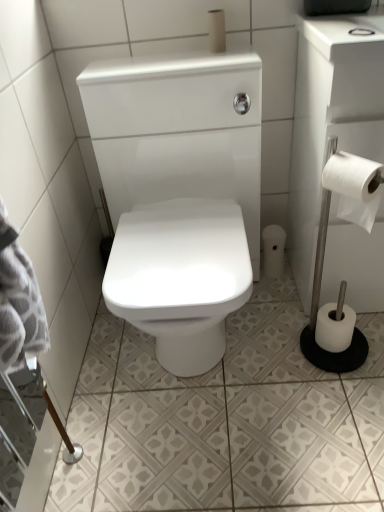
Question: Considering the positions of white paper roll at lower right, the 3th toilet paper in the right-to-left sequence, and white glossy ceramic tile at center in the image, is white paper roll at lower right, the 3th toilet paper in the right-to-left sequence, wider or thinner than white glossy ceramic tile at center?

Choices:
 (A) thin
 (B) wide

Answer: (A)

Question: Would you say white paper roll at lower right, marked as the 2th toilet paper in a left-to-right arrangement, is to the left or to the right of white glossy ceramic tile at center in the picture?

Choices:
 (A) right
 (B) left

Answer: (A)

Question: Considering the real-world distances, which object is closest to the white glossy ceramic tile at center?

Choices:
 (A) white glossy toilet at center
 (B) white paper roll at lower right, marked as the 2th toilet paper in a left-to-right arrangement
 (C) white matte toilet paper at lower right, the first toilet paper from the right
 (D) white matte toilet paper at upper center, which is counted as the first toilet paper, starting from the left
 (E) white paper at right, the second toilet paper viewed from the right

Answer: (C)

Question: Considering the real-world distances, which object is farthest from the white paper roll at lower right, the fourth toilet paper when ordered from front to back?

Choices:
 (A) white paper at right, the 3th toilet paper in the left-to-right sequence
 (B) white glossy toilet at center
 (C) white matte toilet paper at lower right, the 1th toilet paper in the bottom-to-top sequence
 (D) white matte toilet paper at upper center, placed as the 4th toilet paper when sorted from bottom to top
 (E) white glossy ceramic tile at center

Answer: (D)